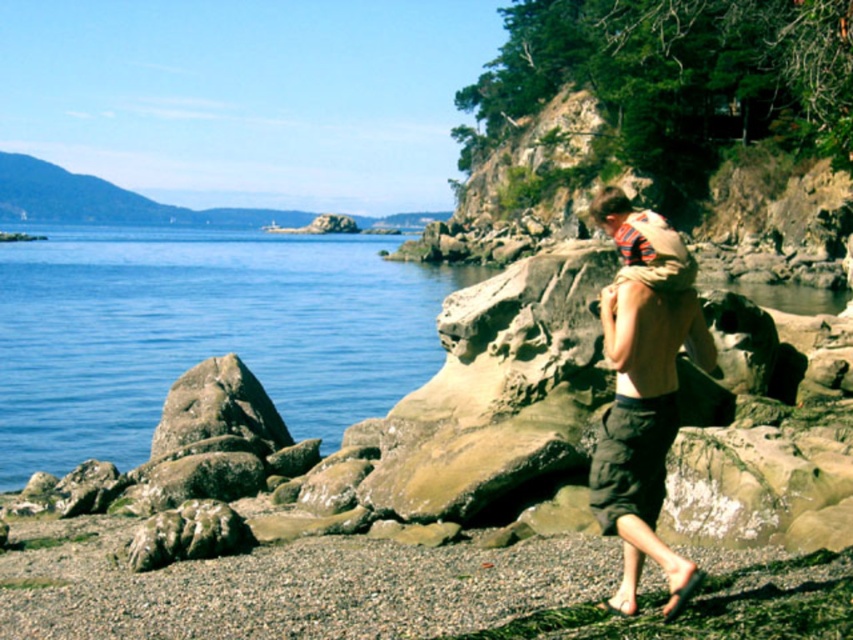
Does point (657, 353) come in front of point (218, 387)?

That is True.

Does brown cotton shirt at center appear over rough textured rock at left?

Correct, brown cotton shirt at center is located above rough textured rock at left.

Measure the distance between point (x=645, y=538) and camera.

The distance of point (x=645, y=538) from camera is 69.91 feet.

Locate an element on the screen. The width and height of the screenshot is (853, 640). brown cotton shirt at center is located at coordinates tap(643, 387).

Measure the distance between brown cotton shirt at center and camera.

67.13 feet

Is point (670, 424) positioned after point (627, 387)?

That is False.

What do you see at coordinates (643, 387) in the screenshot? I see `brown cotton shirt at center` at bounding box center [643, 387].

The height and width of the screenshot is (640, 853). What are the coordinates of `brown cotton shirt at center` in the screenshot? It's located at (643, 387).

Can you confirm if dark brown cotton shorts at lower right is positioned to the right of rough textured rock at left?

Yes, dark brown cotton shorts at lower right is to the right of rough textured rock at left.

Is point (663, 481) positioned before point (170, 440)?

Yes, point (663, 481) is closer to viewer.

Where is `dark brown cotton shorts at lower right`? dark brown cotton shorts at lower right is located at coordinates (631, 460).